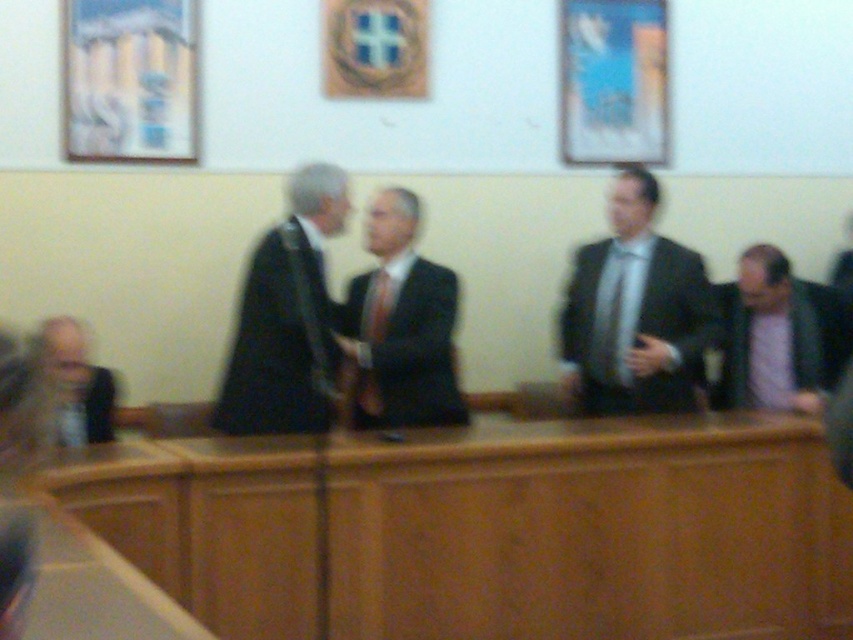
Question: Can you confirm if matte black suit at right is positioned to the left of matte black tie at center?

Choices:
 (A) yes
 (B) no

Answer: (B)

Question: Is matte black suit at right to the left of matte black suit at center from the viewer's perspective?

Choices:
 (A) no
 (B) yes

Answer: (A)

Question: Which point is farther to the camera?

Choices:
 (A) (334, 387)
 (B) (820, 333)
 (C) (368, 388)

Answer: (B)

Question: Does light brown leather jacket at lower left have a greater width compared to matte black tie at center?

Choices:
 (A) yes
 (B) no

Answer: (A)

Question: Considering the real-world distances, which object is closest to the light brown leather jacket at lower left?

Choices:
 (A) pink fabric shirt at lower right
 (B) matte black tie at center
 (C) matte black suit at right

Answer: (B)

Question: Which point is farther to the camera?

Choices:
 (A) (386, 310)
 (B) (581, 403)
 (C) (366, 401)
 (D) (62, 356)

Answer: (B)